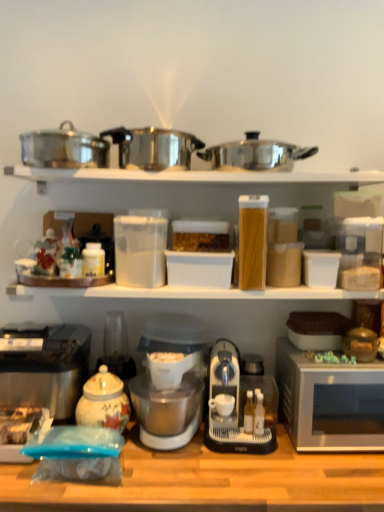
Identify the location of free spot to the right of porcelain floral tea pot at lower left. The image size is (384, 512). (151, 453).